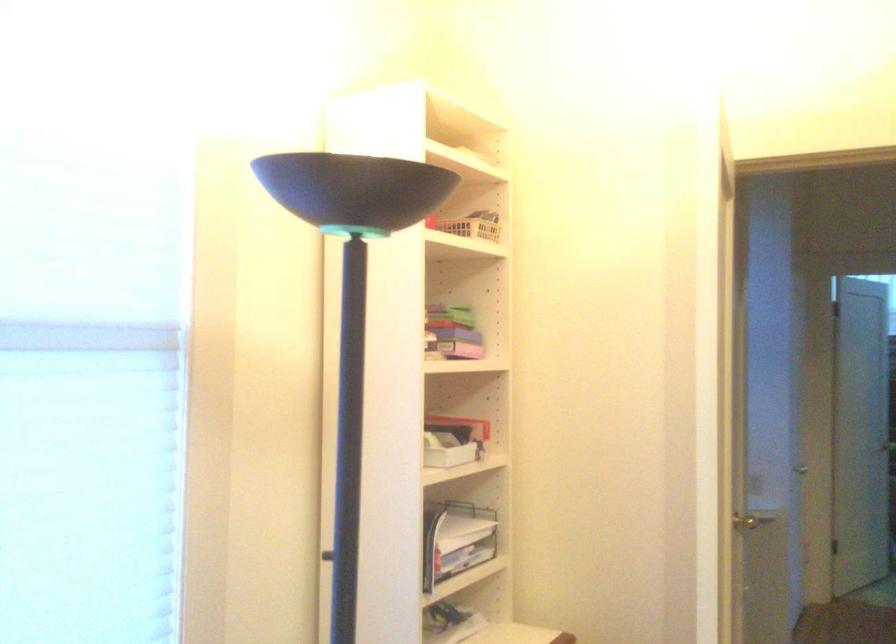
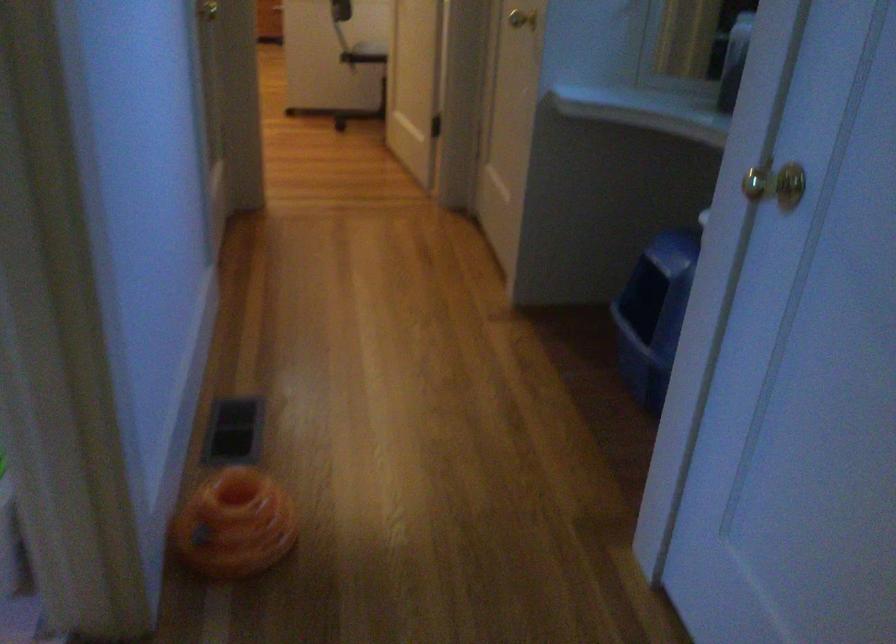
The point at (739, 540) is marked in the first image. Where is the corresponding point in the second image?

(521, 19)